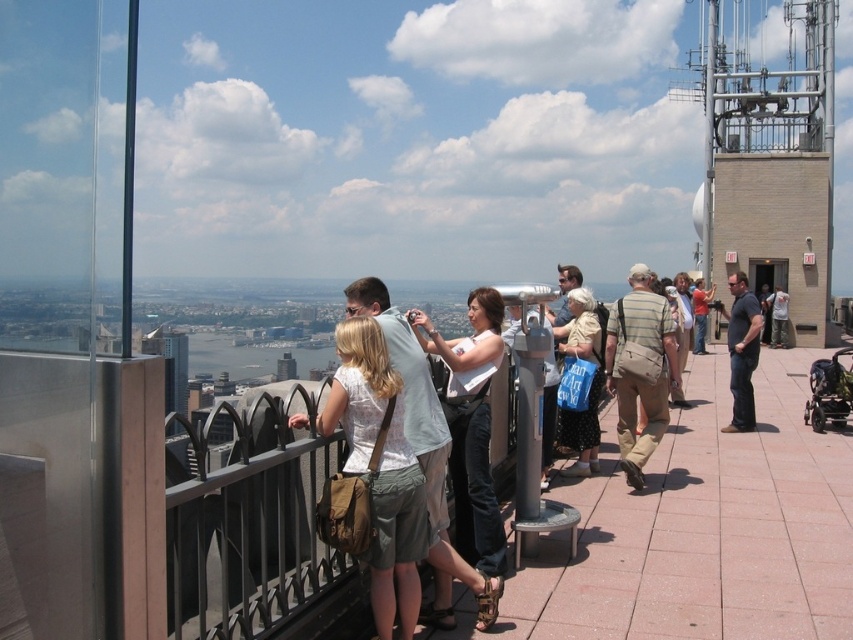
Question: Is tan canvas bag at center above blue fabric bag at center?

Choices:
 (A) yes
 (B) no

Answer: (A)

Question: Can you confirm if tan canvas bag at center is positioned above blue fabric bag at center?

Choices:
 (A) no
 (B) yes

Answer: (B)

Question: Which of these objects is positioned closest to the white fabric shirt at center?

Choices:
 (A) matte brown bag at center
 (B) red shirt at center
 (C) blue fabric bag at center
 (D) tan canvas bag at center

Answer: (C)

Question: Which point is closer to the camera?

Choices:
 (A) (646, 406)
 (B) (360, 410)

Answer: (B)

Question: Which object is farther from the camera taking this photo?

Choices:
 (A) matte brown bag at center
 (B) tan canvas bag at center
 (C) white fabric shirt at center
 (D) red shirt at center

Answer: (D)

Question: Considering the relative positions of matte brown bag at center and red shirt at center in the image provided, where is matte brown bag at center located with respect to red shirt at center?

Choices:
 (A) right
 (B) left

Answer: (B)